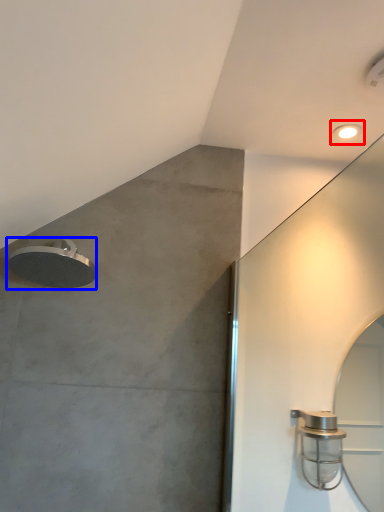
Question: Which of the following is the closest to the observer, droplight (highlighted by a red box) or shower (highlighted by a blue box)?

Choices:
 (A) droplight
 (B) shower

Answer: (B)